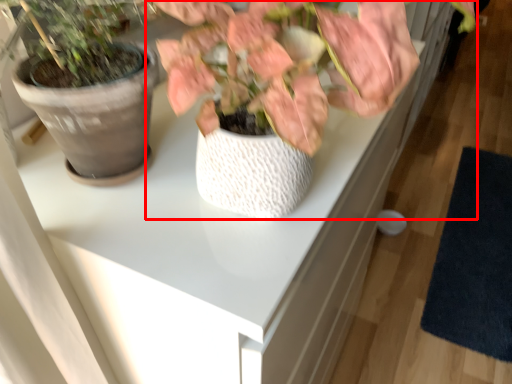
Question: From the image's perspective, considering the relative positions of houseplant (annotated by the red box) and mat in the image provided, where is houseplant (annotated by the red box) located with respect to the staircase?

Choices:
 (A) below
 (B) above

Answer: (B)